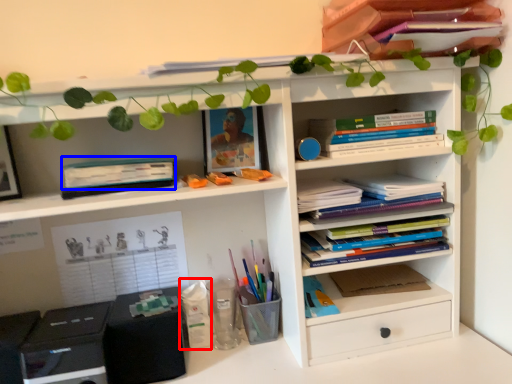
Question: Which object is closer to the camera taking this photo, stationery (highlighted by a red box) or paperback book (highlighted by a blue box)?

Choices:
 (A) stationery
 (B) paperback book

Answer: (B)